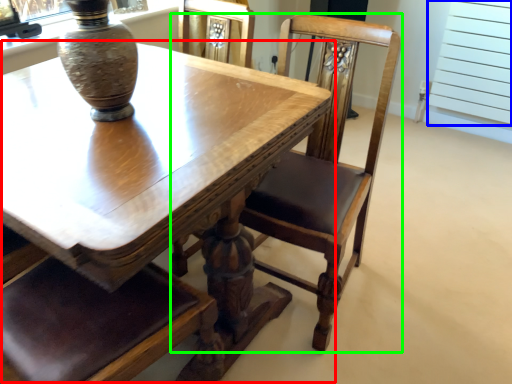
Question: Considering the real-world distances, which object is closest to table (highlighted by a red box)? screen door (highlighted by a blue box) or chair (highlighted by a green box).

Choices:
 (A) screen door
 (B) chair

Answer: (B)